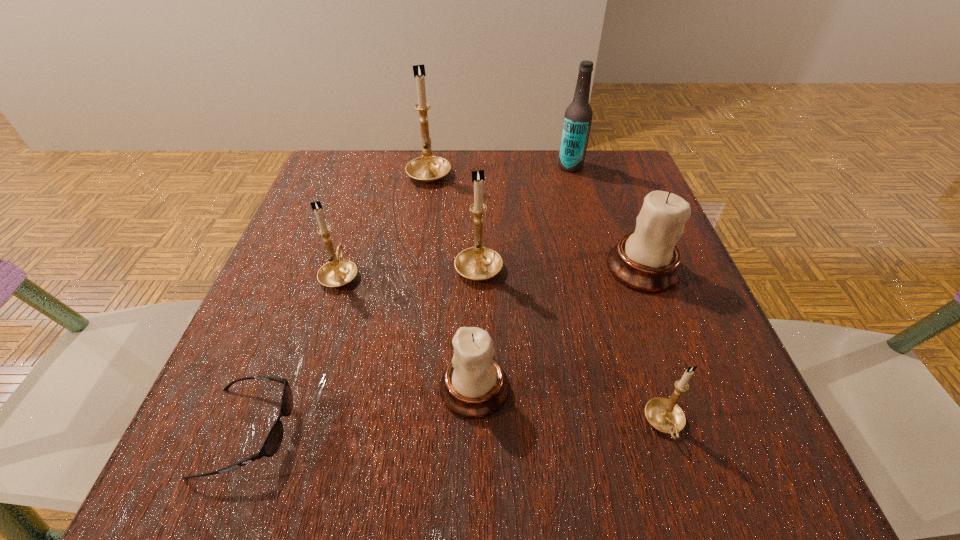
Find the location of `free area in between the nearest gold candle holder and the leftmost gold candle holder`. free area in between the nearest gold candle holder and the leftmost gold candle holder is located at coordinates (502, 349).

This screenshot has width=960, height=540. I want to click on unoccupied position between the farthest gold candle holder and the shortest object, so click(339, 302).

The image size is (960, 540). Identify the location of free spot between the leftmost gold candle holder and the third smallest gold candle holder. (409, 269).

Locate an element on the screen. The image size is (960, 540). free spot between the beer bottle and the leftmost gold candle holder is located at coordinates (455, 220).

Where is `unoccupied area between the tallest candle holder and the smaller white candle holder`? Image resolution: width=960 pixels, height=540 pixels. unoccupied area between the tallest candle holder and the smaller white candle holder is located at coordinates (452, 280).

Identify the location of object that ranks as the fifth closest to the biggest gold candle holder. (474, 385).

Identify which object is the third nearest to the leftmost gold candle holder. Please provide its 2D coordinates. Your answer should be formatted as a tuple, i.e. [(x, y)], where the tuple contains the x and y coordinates of a point satisfying the conditions above.

[(474, 385)]

At what (x,y) coordinates should I click in order to perform the action: click on candle holder object that ranks as the fifth closest to the right white candle holder. Please return your answer as a coordinate pair (x, y). The height and width of the screenshot is (540, 960). Looking at the image, I should click on (338, 272).

Select which candle holder appears as the fourth closest to the right white candle holder. Please provide its 2D coordinates. Your answer should be formatted as a tuple, i.e. [(x, y)], where the tuple contains the x and y coordinates of a point satisfying the conditions above.

[(428, 168)]

The width and height of the screenshot is (960, 540). I want to click on gold candle holder that stands as the closest to the rightmost gold candle holder, so click(478, 263).